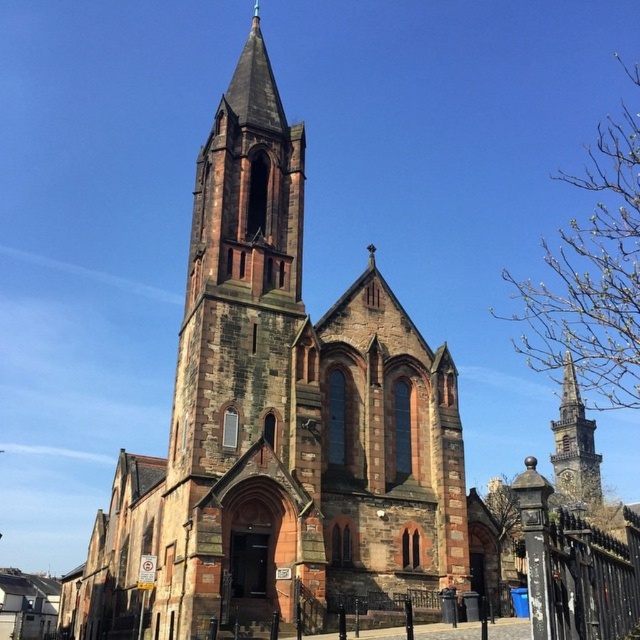
Question: Is brown stone church at center further to camera compared to stone spire at right?

Choices:
 (A) yes
 (B) no

Answer: (B)

Question: Which of the following is the closest to the observer?

Choices:
 (A) brown stone church at center
 (B) stone spire at right

Answer: (A)

Question: Which of the following is the closest to the observer?

Choices:
 (A) pyautogui.click(x=234, y=467)
 (B) pyautogui.click(x=595, y=461)

Answer: (A)

Question: Can you confirm if brown stone church at center is positioned to the right of stone spire at right?

Choices:
 (A) no
 (B) yes

Answer: (A)

Question: Among these objects, which one is farthest from the camera?

Choices:
 (A) brown stone church at center
 (B) stone spire at right

Answer: (B)

Question: Is brown stone church at center thinner than stone spire at right?

Choices:
 (A) yes
 (B) no

Answer: (B)